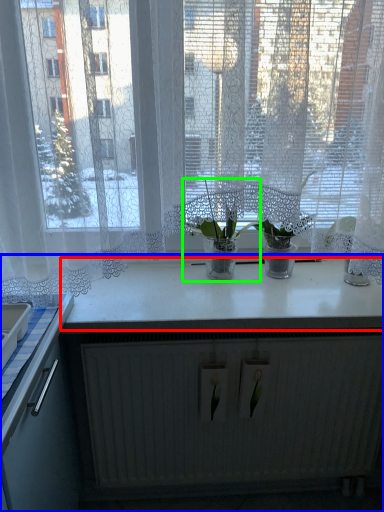
Question: Based on their relative distances, which object is nearer to counter top (highlighted by a red box)? Choose from countertop (highlighted by a blue box) and houseplant (highlighted by a green box).

Choices:
 (A) countertop
 (B) houseplant

Answer: (A)